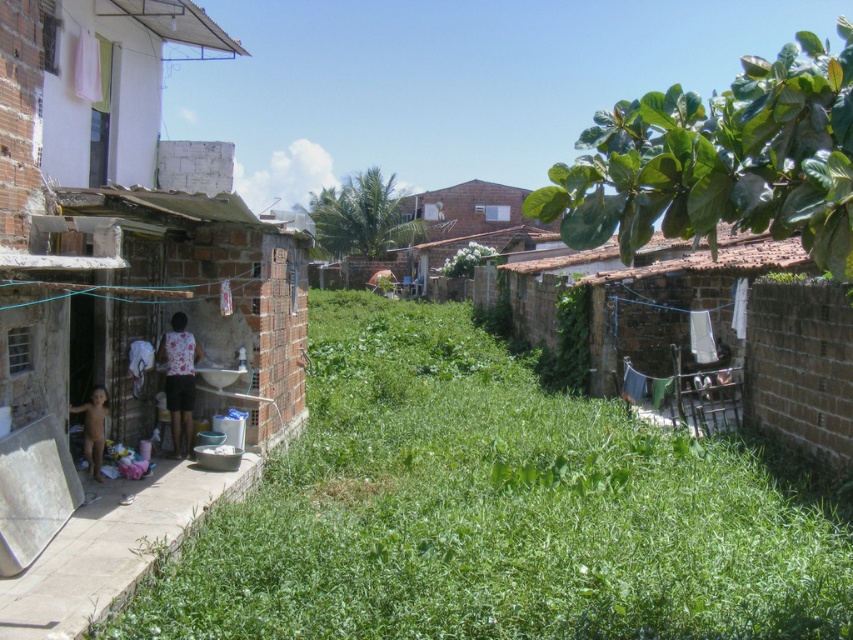
You are standing at the grassy pathway bordered by low brick walls and want to walk towards the two points marked in the image. Which point, point [366,616] or point [120,307], will you reach first?

Point [366,616] is closer to the viewer than point [120,307], so you will reach point [366,616] first.